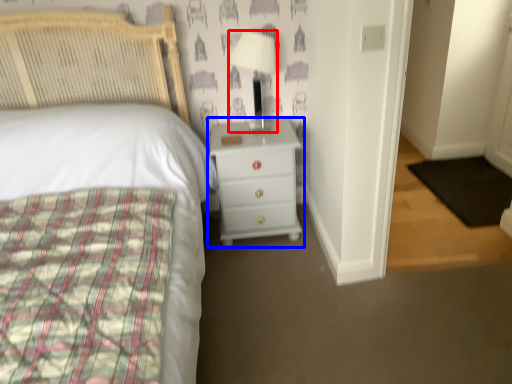
Question: Among these objects, which one is nearest to the camera, lamp (highlighted by a red box) or chest of drawers (highlighted by a blue box)?

Choices:
 (A) lamp
 (B) chest of drawers

Answer: (A)